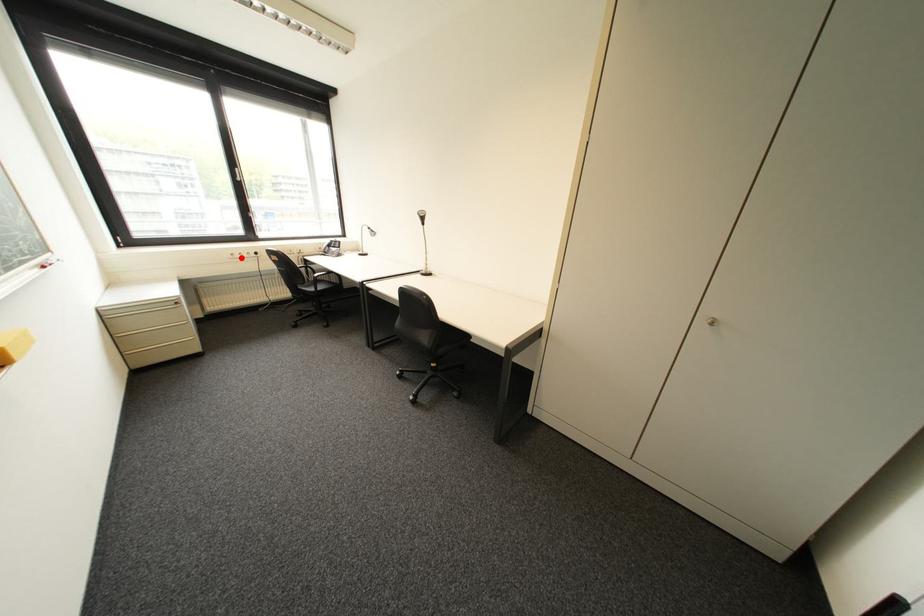
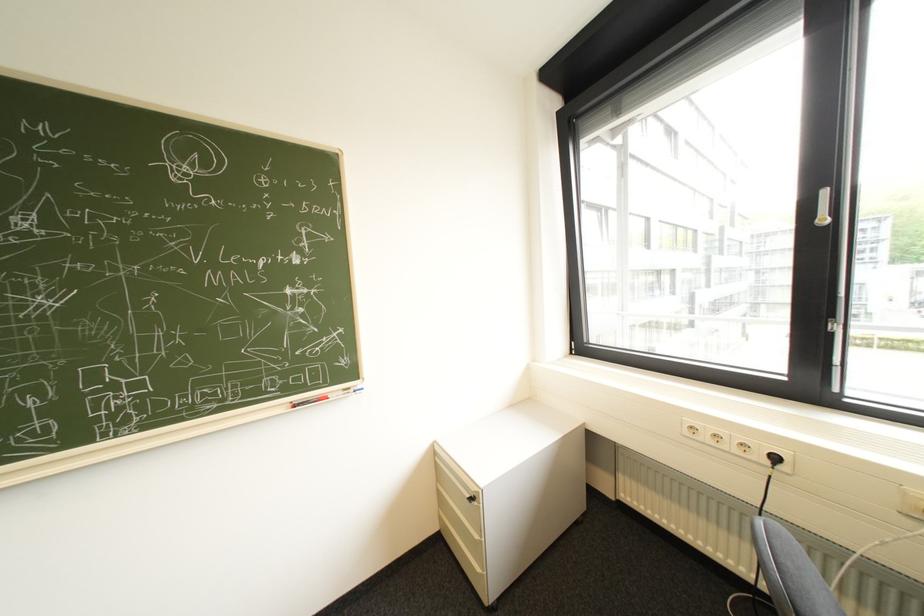
In the second image, find the point that corresponds to the highlighted location in the first image.

(698, 434)